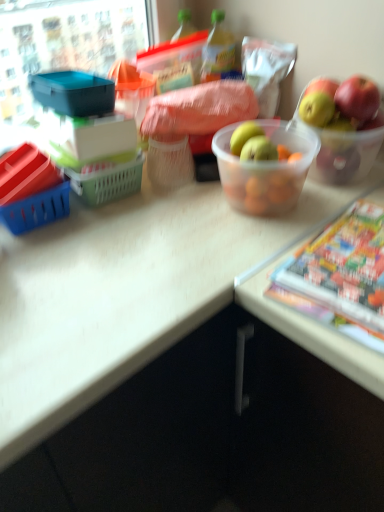
Where is `green plastic bottle at center`? This screenshot has width=384, height=512. green plastic bottle at center is located at coordinates (218, 50).

The image size is (384, 512). Describe the element at coordinates (266, 169) in the screenshot. I see `translucent plastic bowl at center` at that location.

Where is `translucent plastic bowl at center`? The height and width of the screenshot is (512, 384). translucent plastic bowl at center is located at coordinates (266, 169).

At what (x,y) coordinates should I click in order to perform the action: click on multicolored glossy comic book at lower right. Please return your answer as a coordinate pair (x, y). Looking at the image, I should click on (340, 275).

How much distance is there between green plastic bottle at center and multicolored glossy comic book at lower right?

green plastic bottle at center and multicolored glossy comic book at lower right are 24.65 inches apart.

Who is smaller, green plastic bottle at center or multicolored glossy comic book at lower right?

green plastic bottle at center.

Is green plastic bottle at center oriented away from multicolored glossy comic book at lower right?

No, green plastic bottle at center's orientation is not away from multicolored glossy comic book at lower right.

Based on the photo, which object is wider, green plastic bottle at center or multicolored glossy comic book at lower right?

With larger width is multicolored glossy comic book at lower right.

Which object is positioned more to the right, multicolored glossy comic book at lower right or translucent plastic bowl at center?

multicolored glossy comic book at lower right is more to the right.

From a real-world perspective, is multicolored glossy comic book at lower right above or below translucent plastic bowl at center?

In terms of real-world spatial position, multicolored glossy comic book at lower right is below translucent plastic bowl at center.

What's the angular difference between multicolored glossy comic book at lower right and translucent plastic bowl at center's facing directions?

The angular difference between multicolored glossy comic book at lower right and translucent plastic bowl at center is 88.2 degrees.

Is translucent plastic bowl at center thinner than multicolored glossy comic book at lower right?

Yes.

Can multicolored glossy comic book at lower right be found inside translucent plastic bowl at center?

No, multicolored glossy comic book at lower right is not inside translucent plastic bowl at center.

Does point (257, 169) come closer to viewer compared to point (358, 322)?

No, (257, 169) is behind (358, 322).

Is translucent plastic bowl at center turned away from multicolored glossy comic book at lower right?

No, translucent plastic bowl at center's orientation is not away from multicolored glossy comic book at lower right.

Can we say multicolored glossy comic book at lower right lies outside green plastic bottle at center?

Absolutely, multicolored glossy comic book at lower right is external to green plastic bottle at center.

Considering the sizes of multicolored glossy comic book at lower right and green plastic bottle at center in the image, is multicolored glossy comic book at lower right wider or thinner than green plastic bottle at center?

Clearly, multicolored glossy comic book at lower right has more width compared to green plastic bottle at center.

Considering the positions of objects multicolored glossy comic book at lower right and green plastic bottle at center in the image provided, who is behind, multicolored glossy comic book at lower right or green plastic bottle at center?

green plastic bottle at center.

Locate an element on the screen. The width and height of the screenshot is (384, 512). bottle located behind the multicolored glossy comic book at lower right is located at coordinates [218, 50].

Considering the relative positions of green plastic bottle at center and translucent plastic bowl at center in the image provided, is green plastic bottle at center to the left or to the right of translucent plastic bowl at center?

green plastic bottle at center is positioned on translucent plastic bowl at center's left side.

From a real-world perspective, which is physically above, green plastic bottle at center or translucent plastic bowl at center?

green plastic bottle at center, from a real-world perspective.

Is green plastic bottle at center turned away from translucent plastic bowl at center?

That's not correct — green plastic bottle at center is not looking away from translucent plastic bowl at center.

Where is `bottle that is on the left side of translucent plastic bowl at center`? bottle that is on the left side of translucent plastic bowl at center is located at coordinates (218, 50).

Could you tell me if translucent plastic bowl at center is turned towards green plastic bottle at center?

No, translucent plastic bowl at center is not turned towards green plastic bottle at center.

In terms of size, does translucent plastic bowl at center appear bigger or smaller than green plastic bottle at center?

In the image, translucent plastic bowl at center appears to be larger than green plastic bottle at center.

From the image's perspective, between translucent plastic bowl at center and green plastic bottle at center, who is located below?

translucent plastic bowl at center appears lower in the image.

Between translucent plastic bowl at center and green plastic bottle at center, which one has less height?

With less height is green plastic bottle at center.

I want to click on bottle behind the multicolored glossy comic book at lower right, so click(218, 50).

Where is `comic book that appears in front of the translucent plastic bowl at center`? This screenshot has height=512, width=384. comic book that appears in front of the translucent plastic bowl at center is located at coordinates (340, 275).

Looking at the image, which one is located closer to translucent plastic bowl at center, green plastic bottle at center or multicolored glossy comic book at lower right?

multicolored glossy comic book at lower right is positioned closer to the anchor translucent plastic bowl at center.

Based on their spatial positions, is green plastic bottle at center or translucent plastic bowl at center closer to multicolored glossy comic book at lower right?

translucent plastic bowl at center lies closer to multicolored glossy comic book at lower right than the other object.

When comparing their distances from green plastic bottle at center, does multicolored glossy comic book at lower right or translucent plastic bowl at center seem closer?

translucent plastic bowl at center is positioned closer to the anchor green plastic bottle at center.

Estimate the real-world distances between objects in this image. Which object is closer to translucent plastic bowl at center, multicolored glossy comic book at lower right or green plastic bottle at center?

Among the two, multicolored glossy comic book at lower right is located nearer to translucent plastic bowl at center.

Estimate the real-world distances between objects in this image. Which object is further from multicolored glossy comic book at lower right, translucent plastic bowl at center or green plastic bottle at center?

green plastic bottle at center is further to multicolored glossy comic book at lower right.

Looking at the image, which one is located further to green plastic bottle at center, translucent plastic bowl at center or multicolored glossy comic book at lower right?

Among the two, multicolored glossy comic book at lower right is located further to green plastic bottle at center.

I want to click on bowl between green plastic bottle at center and multicolored glossy comic book at lower right in the vertical direction, so click(266, 169).